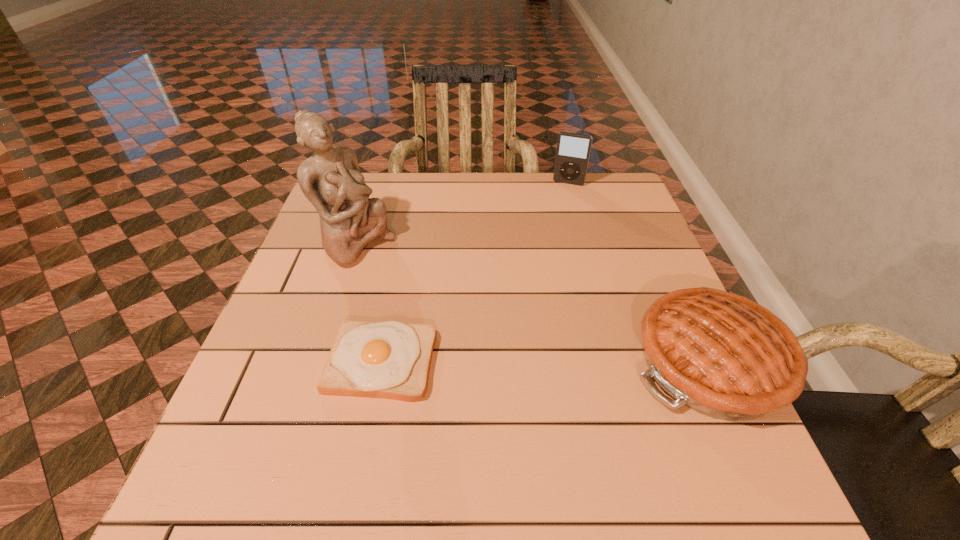
At what (x,y) coordinates should I click in order to perform the action: click on free space at the near right corner. Please return your answer as a coordinate pair (x, y). The height and width of the screenshot is (540, 960). Looking at the image, I should click on 728,447.

Image resolution: width=960 pixels, height=540 pixels. I want to click on free space between the iPod and the toast, so click(475, 273).

The width and height of the screenshot is (960, 540). I want to click on vacant area between the third tallest object and the figurine, so click(534, 303).

Where is `unoccupied area between the pie and the tallest object`? unoccupied area between the pie and the tallest object is located at coordinates (534, 303).

The height and width of the screenshot is (540, 960). I want to click on vacant space in between the toast and the second shortest object, so click(545, 362).

Locate an element on the screen. Image resolution: width=960 pixels, height=540 pixels. free space between the iPod and the shortest object is located at coordinates (475, 273).

You are a GUI agent. You are given a task and a screenshot of the screen. Output one action in this format:
    pyautogui.click(x=<x>, y=<y>)
    Task: Click on the vacant point located between the second tallest object and the tallest object
    
    Given the screenshot: What is the action you would take?
    pyautogui.click(x=463, y=213)

Identify the location of empty space that is in between the toast and the third tallest object. (545, 362).

This screenshot has width=960, height=540. Identify the location of unoccupied position between the pie and the toast. (545, 362).

Identify the location of vacant region between the third tallest object and the toast. (545, 362).